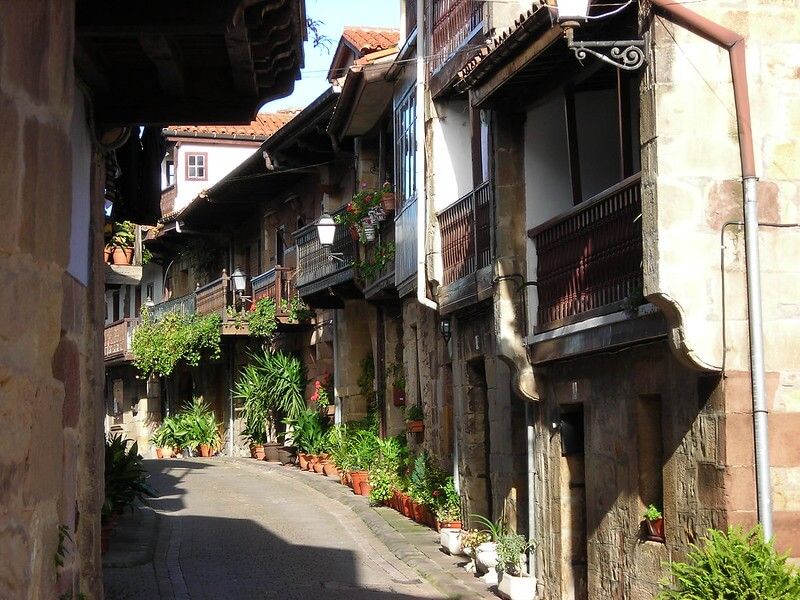
You are a GUI agent. You are given a task and a screenshot of the screen. Output one action in this format:
    pyautogui.click(x=<x>, y=<y>)
    Task: Click on the windows
    This screenshot has height=600, width=800.
    Given the screenshot: What is the action you would take?
    click(196, 161), click(654, 476)